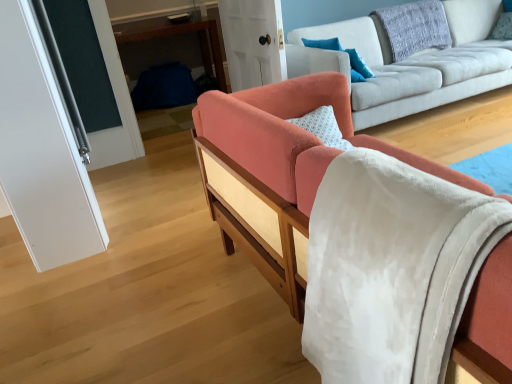
Question: Is textured gray pillow at upper right, which appears as the second pillow when viewed from the right, further to the viewer compared to light gray fabric couch at center, the second studio couch from the front?

Choices:
 (A) yes
 (B) no

Answer: (A)

Question: Does textured gray pillow at upper right, the second pillow positioned from the left, come in front of light gray fabric couch at center, the first studio couch positioned from the back?

Choices:
 (A) yes
 (B) no

Answer: (B)

Question: Can you confirm if textured gray pillow at upper right, the second pillow positioned from the left, is positioned to the left of light gray fabric couch at center, the first studio couch positioned from the back?

Choices:
 (A) no
 (B) yes

Answer: (B)

Question: Is textured gray pillow at upper right, which appears as the second pillow when viewed from the right, outside of light gray fabric couch at center, the first studio couch positioned from the back?

Choices:
 (A) no
 (B) yes

Answer: (A)

Question: Is textured gray pillow at upper right, which appears as the second pillow when viewed from the right, placed right next to light gray fabric couch at center, the first studio couch positioned from the back?

Choices:
 (A) yes
 (B) no

Answer: (B)

Question: Would you consider textured gray pillow at upper right, the second pillow positioned from the left, to be distant from light gray fabric couch at center, the second studio couch from the front?

Choices:
 (A) no
 (B) yes

Answer: (A)

Question: Can we say coral fabric couch at center, which ranks as the 2th studio couch in back-to-front order, lies outside light gray fabric couch at center, the second studio couch from the front?

Choices:
 (A) yes
 (B) no

Answer: (A)

Question: Is coral fabric couch at center, which ranks as the 2th studio couch in back-to-front order, not close to light gray fabric couch at center, the first studio couch positioned from the back?

Choices:
 (A) no
 (B) yes

Answer: (B)

Question: Considering the relative sizes of coral fabric couch at center, the 1th studio couch when ordered from front to back, and light gray fabric couch at center, the second studio couch from the front, in the image provided, is coral fabric couch at center, the 1th studio couch when ordered from front to back, thinner than light gray fabric couch at center, the second studio couch from the front,?

Choices:
 (A) yes
 (B) no

Answer: (A)

Question: From the image's perspective, is coral fabric couch at center, which ranks as the 2th studio couch in back-to-front order, located beneath light gray fabric couch at center, the first studio couch positioned from the back?

Choices:
 (A) no
 (B) yes

Answer: (B)

Question: From a real-world perspective, does coral fabric couch at center, the 1th studio couch when ordered from front to back, stand above light gray fabric couch at center, the second studio couch from the front?

Choices:
 (A) yes
 (B) no

Answer: (A)

Question: Can you confirm if coral fabric couch at center, which ranks as the 2th studio couch in back-to-front order, is wider than light gray fabric couch at center, the first studio couch positioned from the back?

Choices:
 (A) no
 (B) yes

Answer: (A)

Question: Is coral fabric couch at center, the 1th studio couch when ordered from front to back, directly adjacent to transparent glass door at upper center, the first glass door when ordered from back to front?

Choices:
 (A) no
 (B) yes

Answer: (A)